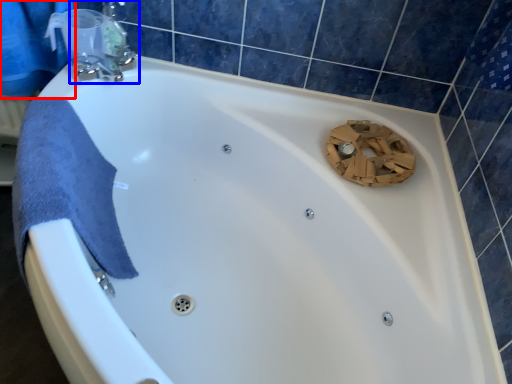
Question: Which object is further to the camera taking this photo, shower curtain (highlighted by a red box) or tap (highlighted by a blue box)?

Choices:
 (A) shower curtain
 (B) tap

Answer: (B)